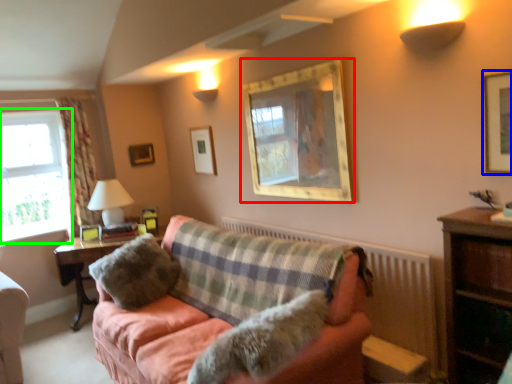
Question: Which is nearer to the picture frame (highlighted by a red box)? picture frame (highlighted by a blue box) or window (highlighted by a green box).

Choices:
 (A) picture frame
 (B) window

Answer: (A)